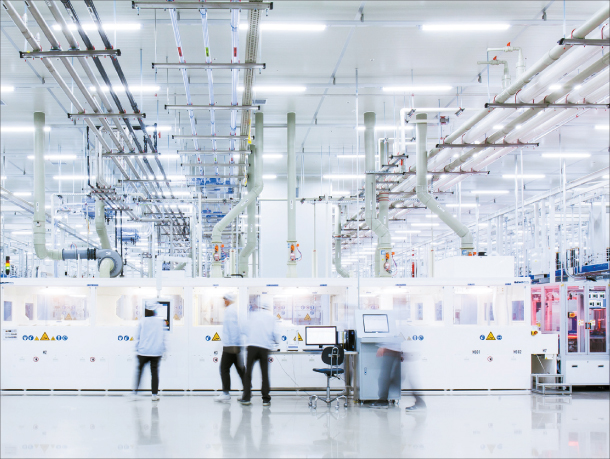
Locate an element on the screen. The image size is (610, 459). chair wheels is located at coordinates (314, 407), (307, 403), (336, 407), (348, 404).